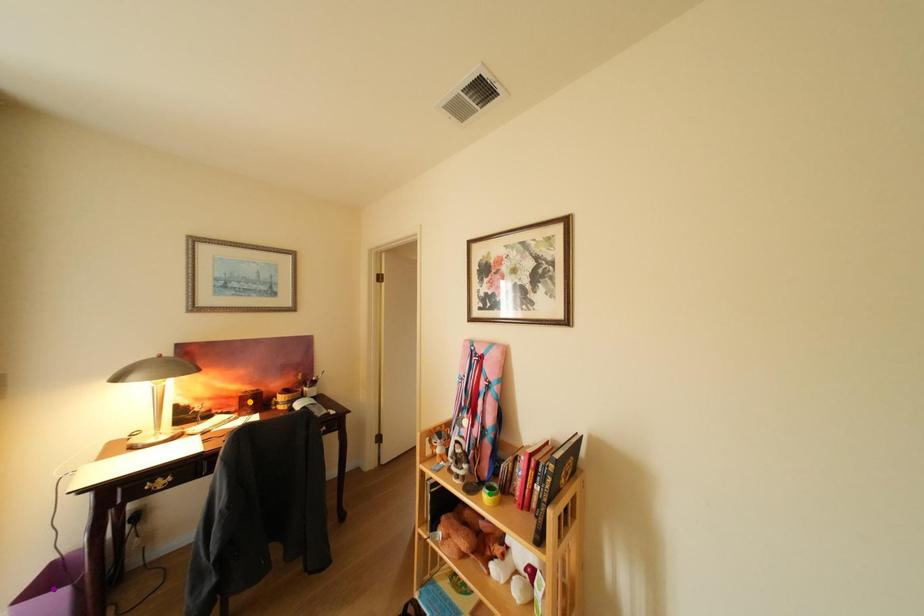
Order these from nearest to farthest:
purple point
green point
orange point

purple point
green point
orange point